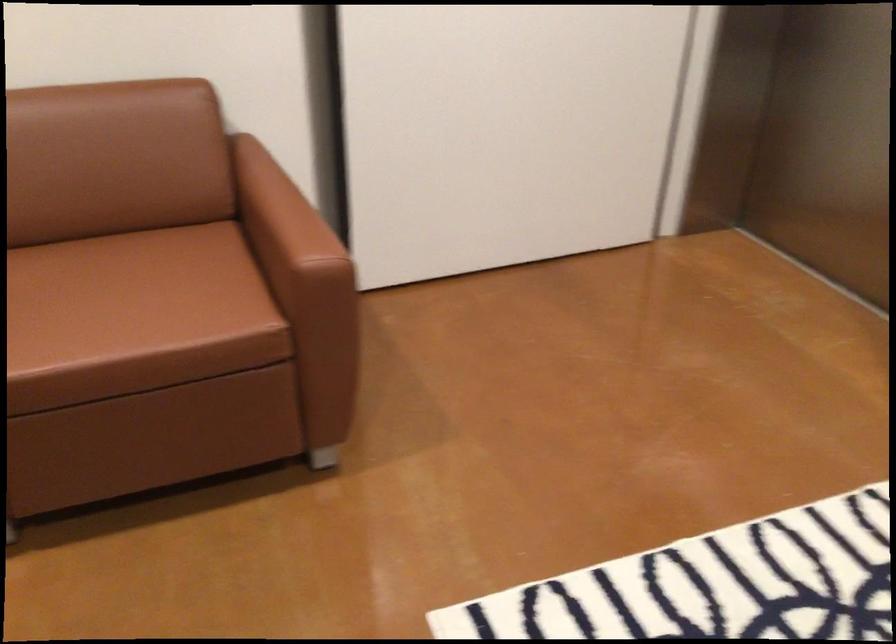
What do you see at coordinates (124, 283) in the screenshot? The image size is (896, 644). I see `the sofa sitting surface` at bounding box center [124, 283].